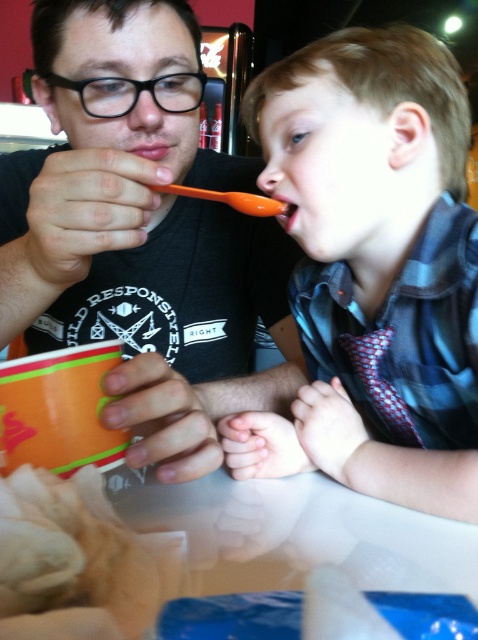
Which is behind, point (406, 504) or point (276, 196)?

The point (276, 196) is behind.

Is matte orange spoon at upper right to the right of matte orange spoon at mouth from the viewer's perspective?

Correct, you'll find matte orange spoon at upper right to the right of matte orange spoon at mouth.

Locate an element on the screen. This screenshot has width=478, height=640. matte orange spoon at upper right is located at coordinates (373, 269).

Looking at this image, does matte orange spoon at upper right have a lesser height compared to matte skin at center?

No.

The image size is (478, 640). What do you see at coordinates (373, 269) in the screenshot?
I see `matte orange spoon at upper right` at bounding box center [373, 269].

Where is `matte orange spoon at upper right`? The width and height of the screenshot is (478, 640). matte orange spoon at upper right is located at coordinates (373, 269).

Between point (332, 276) and point (205, 413), which one is positioned in front?

Positioned in front is point (205, 413).

Which is in front, point (436, 468) or point (76, 209)?

Positioned in front is point (76, 209).

This screenshot has width=478, height=640. In order to click on matte orange spoon at upper right in this screenshot , I will do `click(373, 269)`.